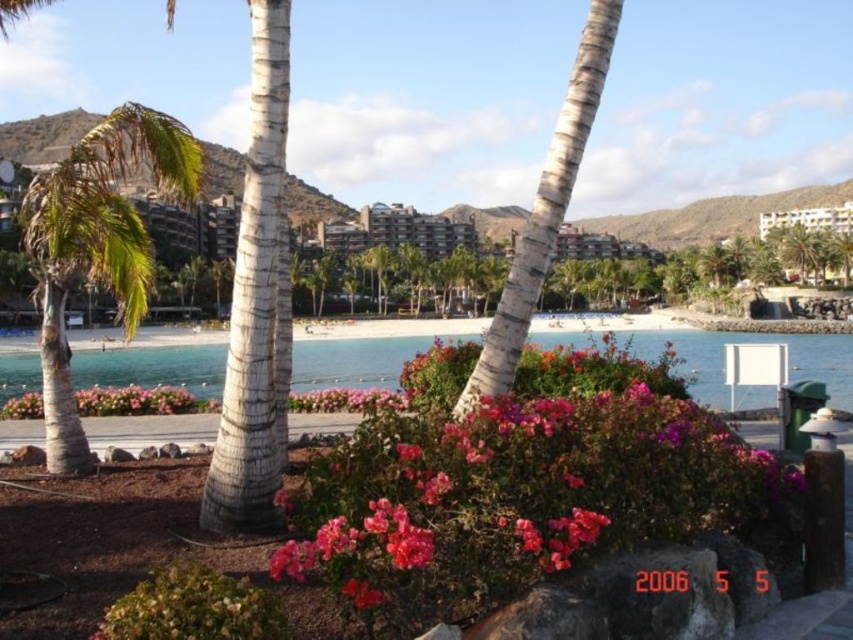
Is green leafy palm tree at center bigger than clear blue water at center?

Indeed, green leafy palm tree at center has a larger size compared to clear blue water at center.

Can you confirm if green leafy palm tree at center is thinner than clear blue water at center?

Yes.

Who is more distant from viewer, (102, 257) or (637, 342)?

Point (637, 342)

This screenshot has width=853, height=640. Identify the location of green leafy palm tree at center. (97, 244).

Who is positioned more to the left, green leafy palm tree at center or pink matte flower at center?

From the viewer's perspective, green leafy palm tree at center appears more on the left side.

Between green leafy palm tree at center and pink matte flower at center, which one is positioned higher?

green leafy palm tree at center is higher up.

Is point (138, 241) less distant than point (375, 589)?

No, (138, 241) is further to viewer.

Locate an element on the screen. This screenshot has width=853, height=640. green leafy palm tree at center is located at coordinates (97, 244).

Is pink matte flowers at lower center below pink matte flowers at center?

Yes, pink matte flowers at lower center is below pink matte flowers at center.

Which is more to the left, pink matte flowers at lower center or pink matte flowers at center?

Positioned to the left is pink matte flowers at lower center.

Image resolution: width=853 pixels, height=640 pixels. In order to click on pink matte flowers at lower center in this screenshot , I will do `click(135, 401)`.